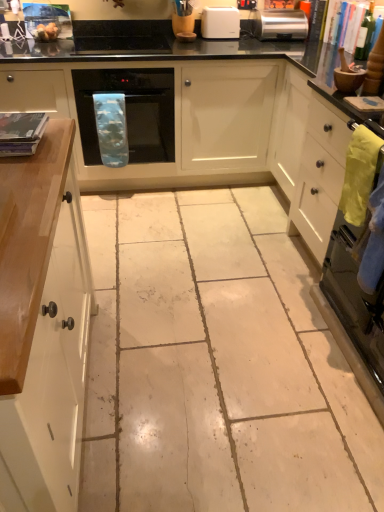
Question: Can you confirm if green glass bottle at upper right is positioned to the right of black glossy countertop at upper center?

Choices:
 (A) no
 (B) yes

Answer: (B)

Question: Are green glass bottle at upper right and black glossy countertop at upper center far apart?

Choices:
 (A) no
 (B) yes

Answer: (A)

Question: Does green glass bottle at upper right touch black glossy countertop at upper center?

Choices:
 (A) yes
 (B) no

Answer: (B)

Question: From the image's perspective, is green glass bottle at upper right beneath black glossy countertop at upper center?

Choices:
 (A) yes
 (B) no

Answer: (B)

Question: Does green glass bottle at upper right have a greater height compared to black glossy countertop at upper center?

Choices:
 (A) no
 (B) yes

Answer: (A)

Question: Considering the positions of point (135, 40) and point (56, 407), is point (135, 40) closer or farther from the camera than point (56, 407)?

Choices:
 (A) farther
 (B) closer

Answer: (A)

Question: From the image's perspective, is black glass cooktop at upper center positioned above or below white glossy cabinet at left?

Choices:
 (A) above
 (B) below

Answer: (A)

Question: Would you say black glass cooktop at upper center is inside or outside white glossy cabinet at left?

Choices:
 (A) outside
 (B) inside

Answer: (A)

Question: Considering the positions of black glass cooktop at upper center and white glossy cabinet at left in the image, is black glass cooktop at upper center bigger or smaller than white glossy cabinet at left?

Choices:
 (A) small
 (B) big

Answer: (A)

Question: Does point (274, 19) appear closer or farther from the camera than point (89, 40)?

Choices:
 (A) closer
 (B) farther

Answer: (A)

Question: In the image, is satin silver toaster at upper right on the left side or the right side of black glass cooktop at upper center?

Choices:
 (A) right
 (B) left

Answer: (A)

Question: Looking at the image, does satin silver toaster at upper right seem bigger or smaller compared to black glass cooktop at upper center?

Choices:
 (A) small
 (B) big

Answer: (A)

Question: Is satin silver toaster at upper right inside the boundaries of black glass cooktop at upper center, or outside?

Choices:
 (A) outside
 (B) inside

Answer: (A)

Question: Based on their positions, is green glass bottle at upper right located to the left or right of white plastic toaster at upper center?

Choices:
 (A) right
 (B) left

Answer: (A)

Question: Based on their sizes in the image, would you say green glass bottle at upper right is bigger or smaller than white plastic toaster at upper center?

Choices:
 (A) small
 (B) big

Answer: (A)